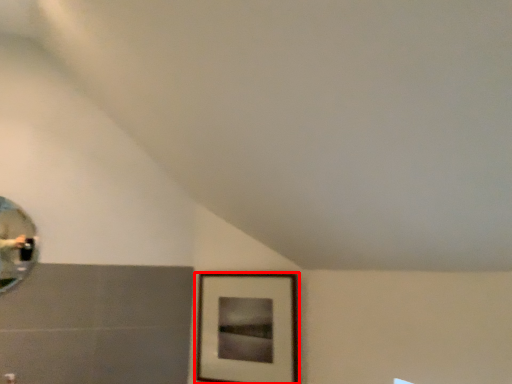
Question: From the image's perspective, considering the relative positions of picture frame (annotated by the red box) and mirror in the image provided, where is picture frame (annotated by the red box) located with respect to the staircase?

Choices:
 (A) below
 (B) above

Answer: (A)